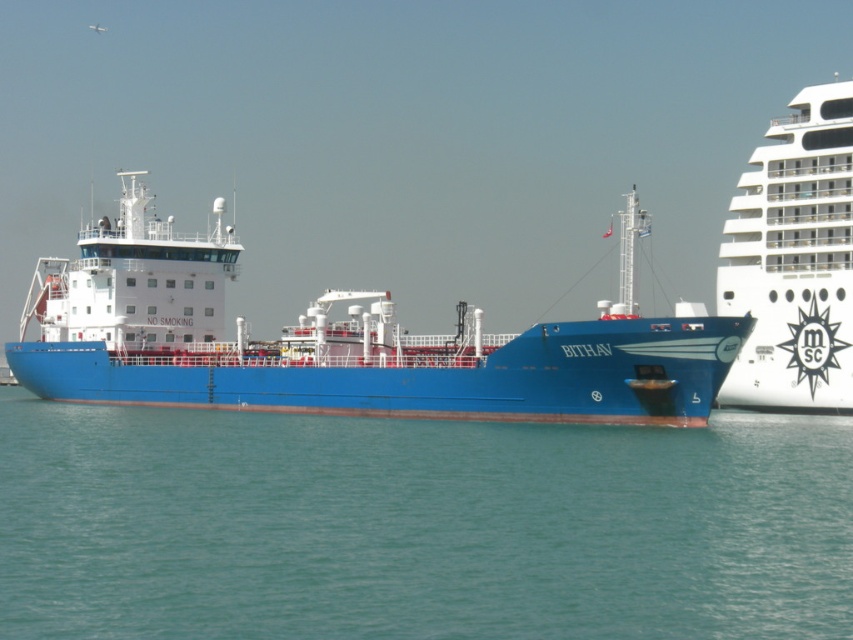
Question: Considering the relative positions of teal water at center and blue matte ship at center in the image provided, where is teal water at center located with respect to blue matte ship at center?

Choices:
 (A) below
 (B) above

Answer: (A)

Question: Does teal water at center appear on the left side of blue matte ship at center?

Choices:
 (A) no
 (B) yes

Answer: (A)

Question: Does teal water at center appear on the right side of blue matte ship at center?

Choices:
 (A) no
 (B) yes

Answer: (B)

Question: Which of the following is the closest to the observer?

Choices:
 (A) (509, 525)
 (B) (431, 355)

Answer: (A)